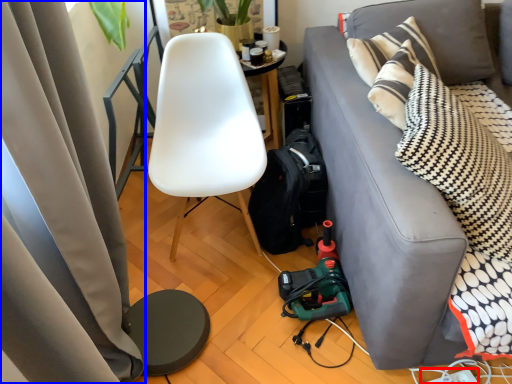
Question: Among these objects, which one is nearest to the camera, power outlet (highlighted by a red box) or curtain (highlighted by a blue box)?

Choices:
 (A) power outlet
 (B) curtain

Answer: (B)